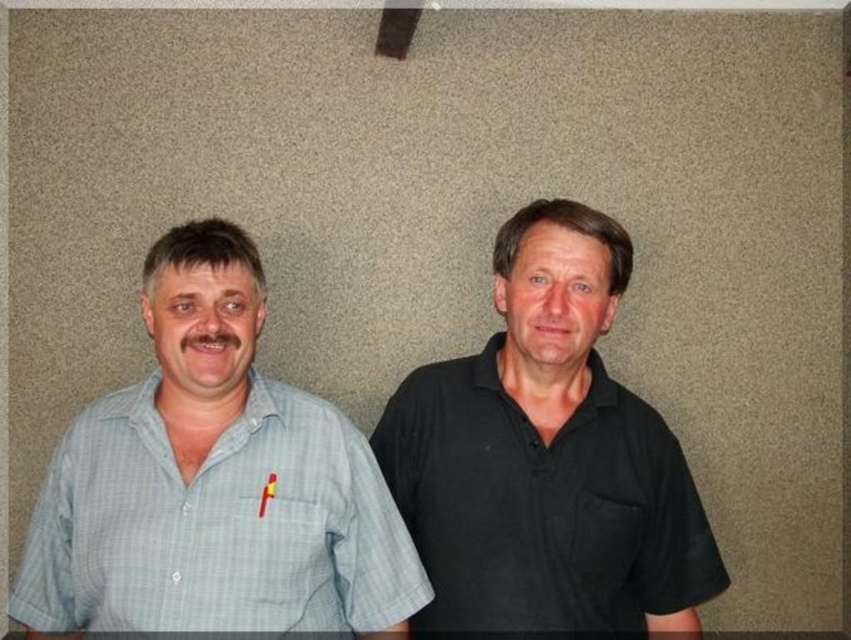
Question: Is black smooth shirt at right smaller than light blue checkered shirt at left?

Choices:
 (A) yes
 (B) no

Answer: (B)

Question: Is black smooth shirt at right below light blue checkered shirt at left?

Choices:
 (A) yes
 (B) no

Answer: (B)

Question: Which of the following is the farthest from the observer?

Choices:
 (A) light blue checkered shirt at left
 (B) black smooth shirt at right

Answer: (B)

Question: Is black smooth shirt at right thinner than light blue checkered shirt at left?

Choices:
 (A) no
 (B) yes

Answer: (B)